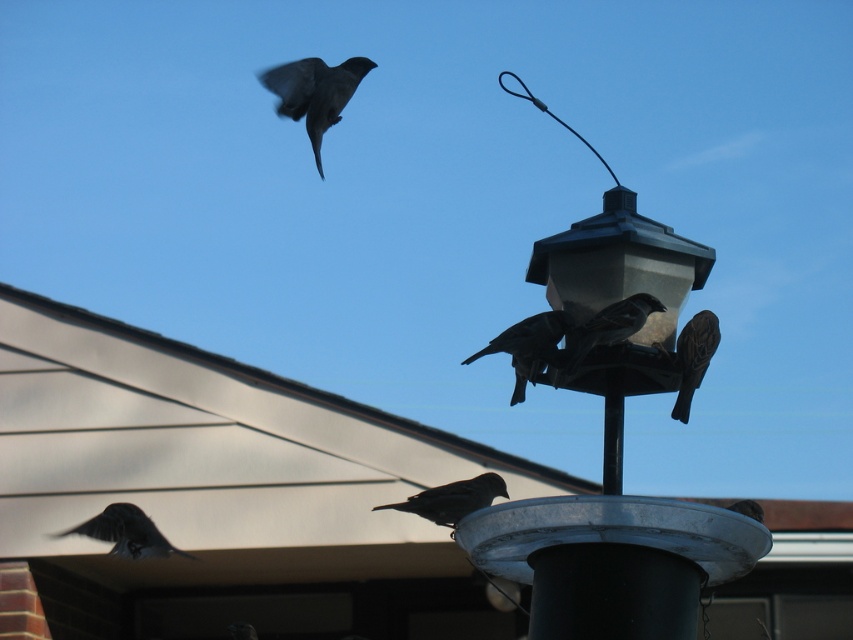
Is the position of metallic gray bird feeder at center less distant than that of silhouette matte bird at center?

Yes, it is.

Does point (569, 572) come in front of point (437, 497)?

Yes, it is in front of point (437, 497).

You are a GUI agent. You are given a task and a screenshot of the screen. Output one action in this format:
    pyautogui.click(x=<x>, y=<y>)
    Task: Click on the metallic gray bird feeder at center
    This screenshot has width=853, height=640.
    Given the screenshot: What is the action you would take?
    pyautogui.click(x=612, y=561)

Between silhouette glossy bird at upper left and black matte pole at center, which one is positioned higher?

silhouette glossy bird at upper left is higher up.

Is point (364, 67) closer to viewer compared to point (614, 472)?

No, it is behind (614, 472).

Does point (335, 76) come closer to viewer compared to point (618, 490)?

That is False.

The height and width of the screenshot is (640, 853). I want to click on silhouette glossy bird at upper left, so click(x=314, y=92).

Does metallic gray bird feeder at center have a larger size compared to dark gray feathers at lower left?

Indeed, metallic gray bird feeder at center has a larger size compared to dark gray feathers at lower left.

This screenshot has width=853, height=640. What are the coordinates of `metallic gray bird feeder at center` in the screenshot? It's located at (612, 561).

Identify the location of metallic gray bird feeder at center. (612, 561).

Where is `metallic gray bird feeder at center`? The height and width of the screenshot is (640, 853). metallic gray bird feeder at center is located at coordinates (612, 561).